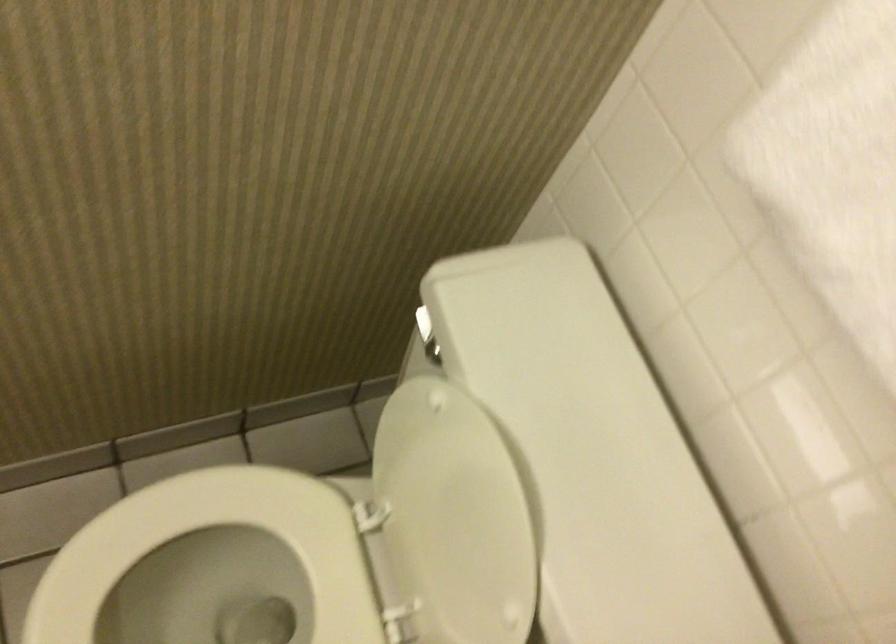
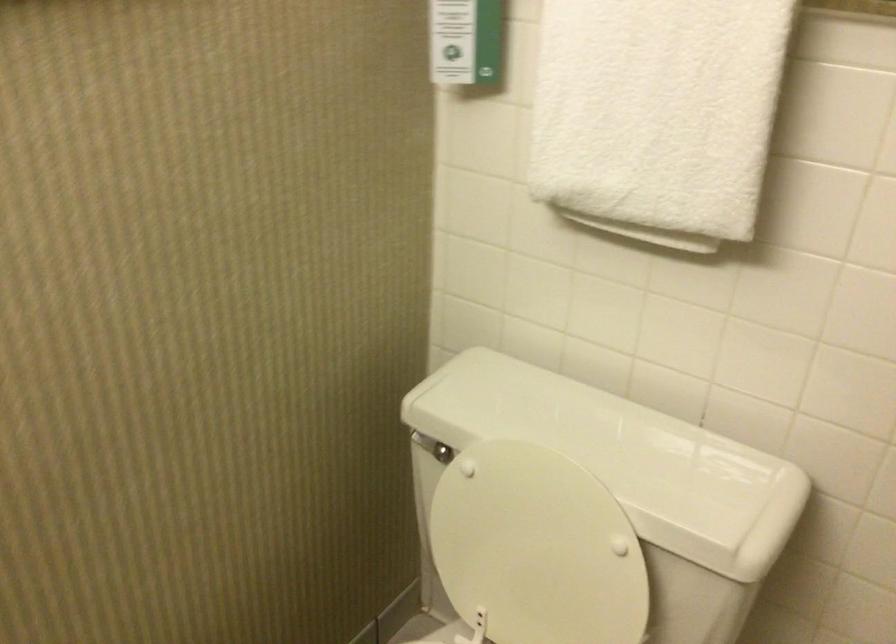
The point at [431,325] is marked in the first image. Where is the corresponding point in the second image?

(425, 444)